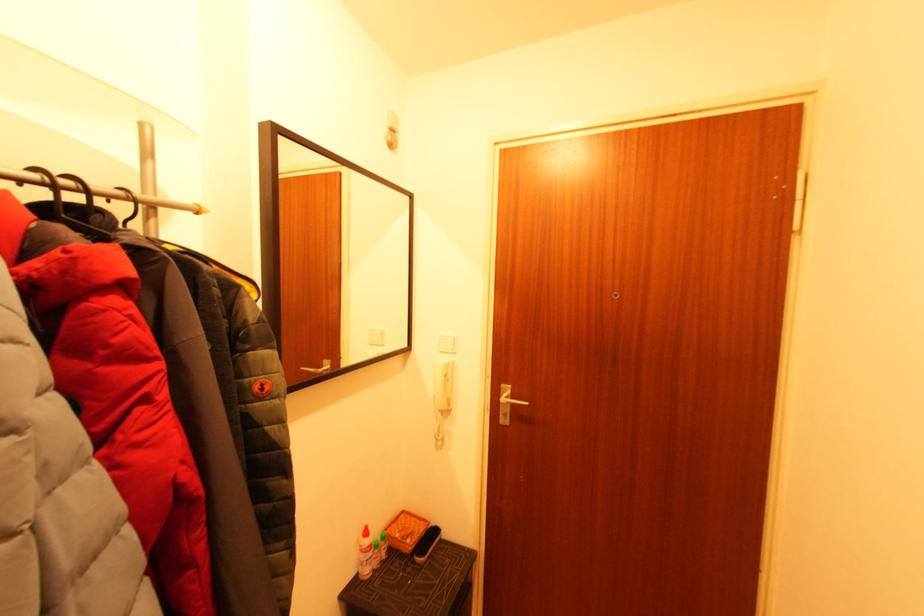
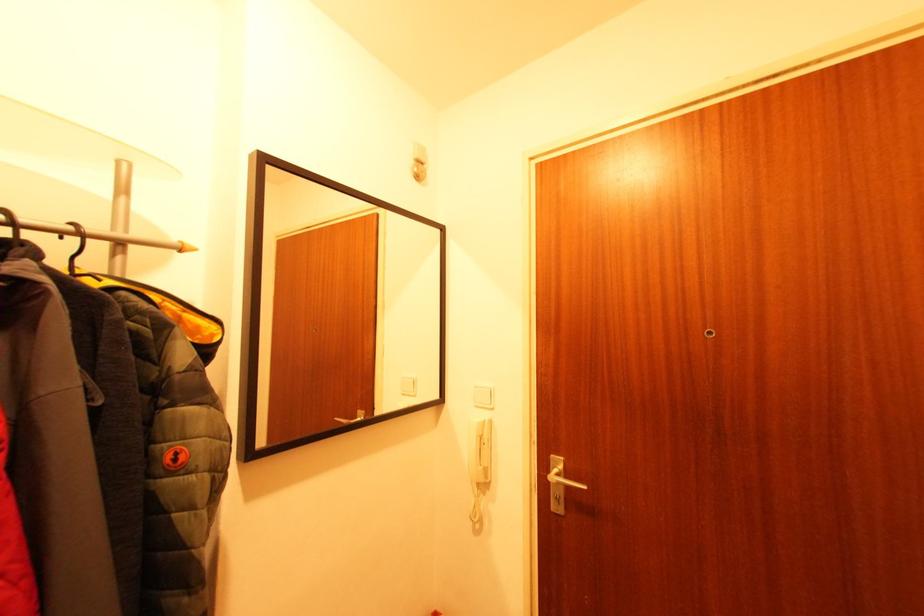
The images are taken continuously from a first-person perspective. In which direction are you moving?

The movement direction of the cameraman is right, forward.